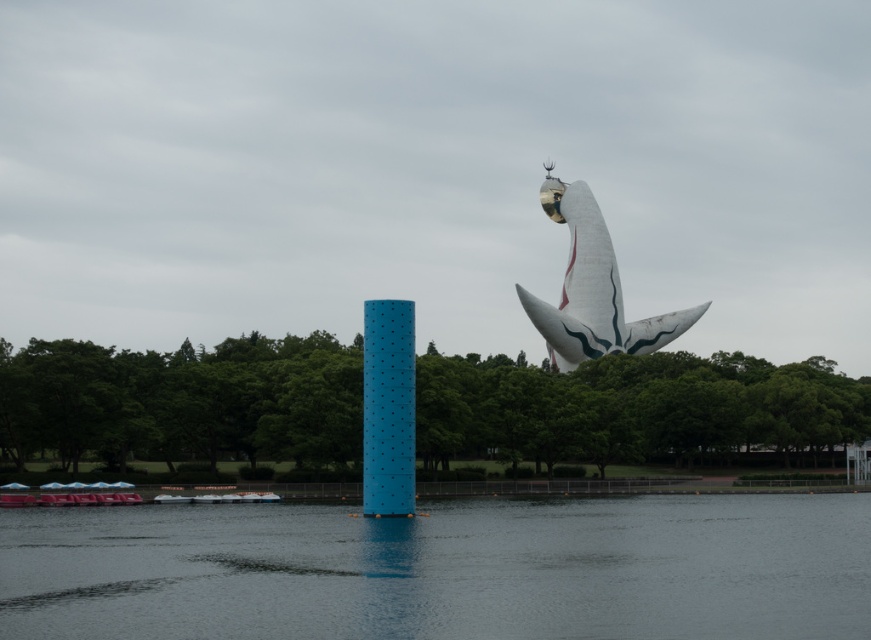
Question: Considering the relative positions of smooth gray water at lower center and white glossy sculpture at upper center in the image provided, where is smooth gray water at lower center located with respect to white glossy sculpture at upper center?

Choices:
 (A) right
 (B) left

Answer: (B)

Question: Which object is closer to the camera taking this photo?

Choices:
 (A) white plastic boat at lower left
 (B) smooth gray water at lower center
 (C) white glossy sculpture at upper center
 (D) blue matte pillar at center

Answer: (B)

Question: Does smooth gray water at lower center come in front of white glossy sculpture at upper center?

Choices:
 (A) yes
 (B) no

Answer: (A)

Question: Based on their relative distances, which object is nearer to the white plastic boat at lower left?

Choices:
 (A) white glossy sculpture at upper center
 (B) blue matte pillar at center
 (C) smooth gray water at lower center

Answer: (B)

Question: Which object appears closest to the camera in this image?

Choices:
 (A) white glossy sculpture at upper center
 (B) white plastic boat at lower left
 (C) smooth gray water at lower center
 (D) blue matte pillar at center

Answer: (C)

Question: Does smooth gray water at lower center have a larger size compared to white plastic boat at lower left?

Choices:
 (A) yes
 (B) no

Answer: (A)